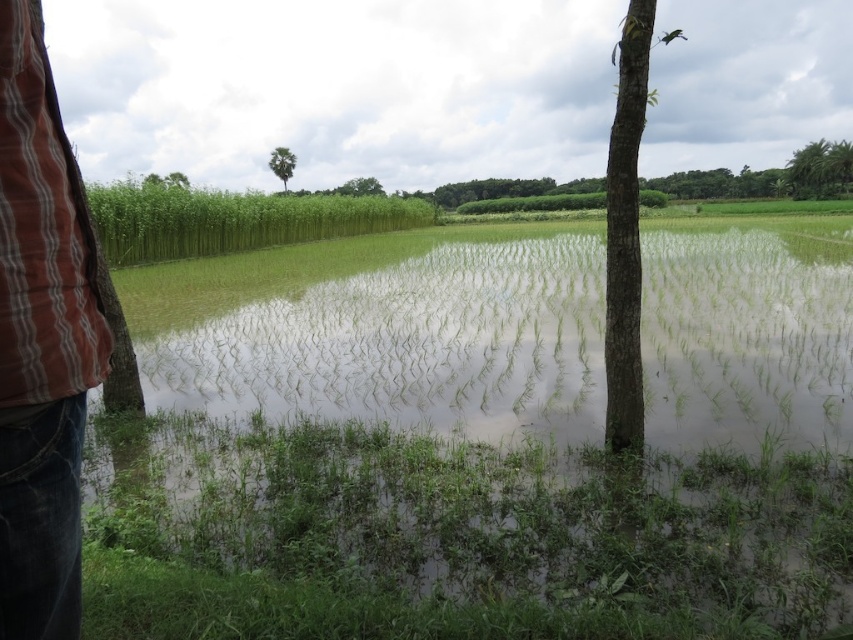
Consider the image. You are a photographer trying to capture the entire scene of the flooded paddy field. You notice the jeans at left and the green leafy tree at upper left in your viewfinder. Which object should you adjust your camera angle to include more of, considering their sizes?

The jeans at left has a smaller size compared to the green leafy tree at upper left. To include more of the smaller object, you should adjust your camera angle to focus on the jeans at left.

You are a visitor in this rural area and want to take a photo of the jeans at left and the green leafy tree at upper left. Which object should you focus on first if you want both to be in the same frame without moving your camera?

You should focus on the jeans at left first because it is closer to you than the green leafy tree at upper left, which is further away. This way, both objects will be in focus within the same frame without needing to adjust the camera position.